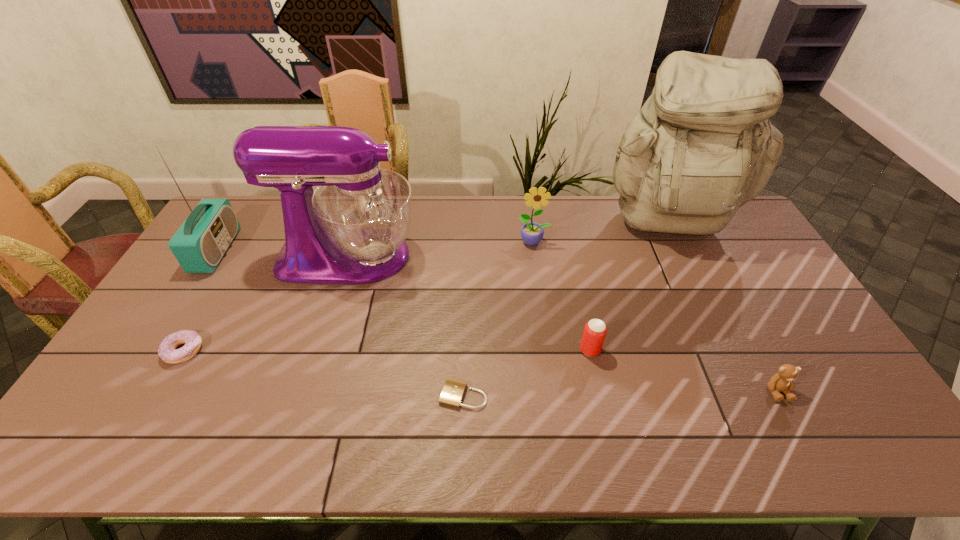
The image size is (960, 540). I want to click on vacant space that's between the tallest object and the beer can, so click(x=629, y=288).

Where is `object that can be found as the fourth closest to the tallest object`? This screenshot has height=540, width=960. object that can be found as the fourth closest to the tallest object is located at coordinates (453, 391).

Identify which object is located as the fifth nearest to the tallest object. Please provide its 2D coordinates. Your answer should be formatted as a tuple, i.e. [(x, y)], where the tuple contains the x and y coordinates of a point satisfying the conditions above.

[(351, 229)]

Where is `free space that satisfies the following two spatial constraints: 1. at the bowl opening of the sixth object from left to right; 2. on the right side of the second tallest object`? The width and height of the screenshot is (960, 540). free space that satisfies the following two spatial constraints: 1. at the bowl opening of the sixth object from left to right; 2. on the right side of the second tallest object is located at coordinates (320, 350).

Locate an element on the screen. This screenshot has width=960, height=540. vacant area in the image that satisfies the following two spatial constraints: 1. at the bowl opening of the fourth object from left to right; 2. on the left side of the second tallest object is located at coordinates (306, 395).

Identify the location of vacant region that satisfies the following two spatial constraints: 1. at the bowl opening of the mixer; 2. on the left side of the fifth tallest object. (320, 350).

Where is `free space that satisfies the following two spatial constraints: 1. on the front-facing side of the backpack; 2. at the bowl opening of the mixer`? Image resolution: width=960 pixels, height=540 pixels. free space that satisfies the following two spatial constraints: 1. on the front-facing side of the backpack; 2. at the bowl opening of the mixer is located at coordinates (684, 256).

Image resolution: width=960 pixels, height=540 pixels. What are the coordinates of `free spot that satisfies the following two spatial constraints: 1. on the front-facing side of the tallest object; 2. on the front panel of the radio receiver` in the screenshot? It's located at click(x=681, y=251).